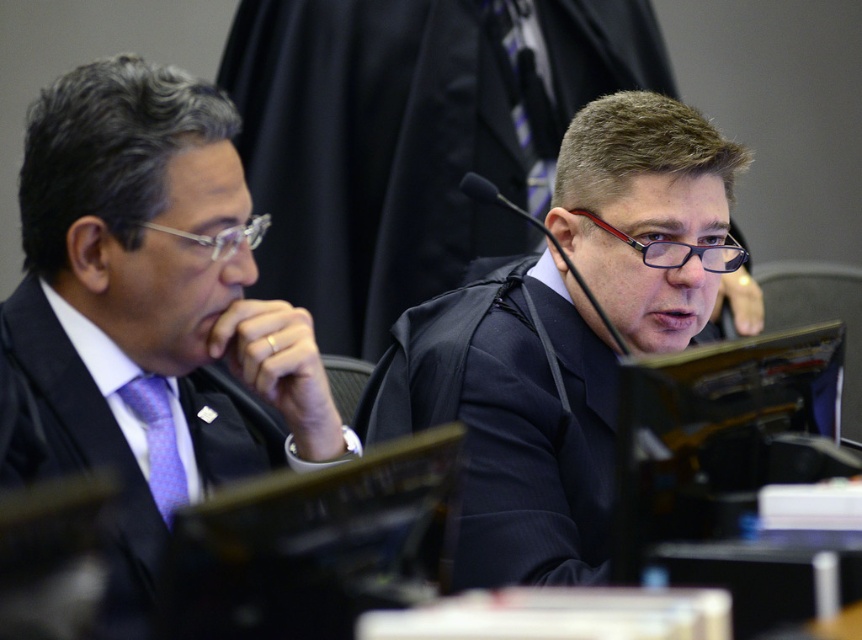
You are an interior designer planning to place a 1.2 meter wide sofa in this courtroom scene. Given the space occupied by the matte black suit at left and the black fabric judge at center, which object would allow more space for the sofa? Please explain based on their widths.

The matte black suit at left has a lesser width compared to the black fabric judge at center. Therefore, placing the sofa near the matte black suit at left would provide more space since it occupies less width than the black fabric judge at center.

You are an observer in a courtroom. You see the matte black suit at left and the black fabric judge at center. Which one is positioned higher in the image?

The matte black suit at left is positioned higher than the black fabric judge at center.